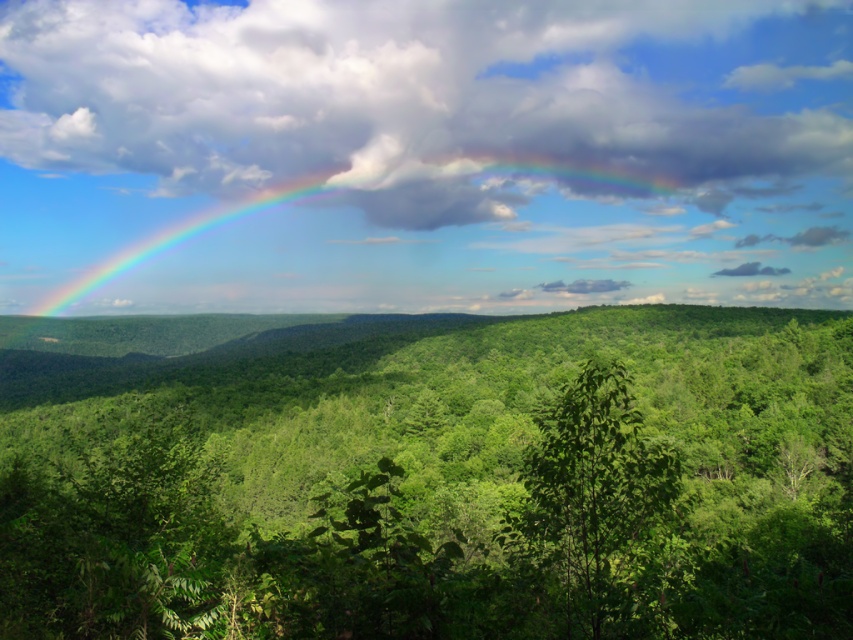
Based on the photo, is cloudy sky at upper center closer to camera compared to rainbow at left?

Yes.

Between cloudy sky at upper center and rainbow at left, which one has less height?

rainbow at left

Find the location of `cloudy sky at upper center`. cloudy sky at upper center is located at coordinates (399, 104).

Between point (323, 408) and point (71, 248), which one is positioned behind?

Positioned behind is point (71, 248).

Is green leafy forest at center smaller than rainbow at left?

Incorrect, green leafy forest at center is not smaller in size than rainbow at left.

Where is `green leafy forest at center`? green leafy forest at center is located at coordinates [x=427, y=474].

Image resolution: width=853 pixels, height=640 pixels. I want to click on green leafy forest at center, so click(427, 474).

Between point (103, 525) and point (613, 449), which one is positioned behind?

Positioned behind is point (103, 525).

Is the position of green leafy tree at lower left less distant than that of green leafy tree at center?

No, it is behind green leafy tree at center.

Between point (178, 589) and point (581, 532), which one is positioned in front?

Point (178, 589)

Identify the location of green leafy tree at lower left. The image size is (853, 640). (115, 534).